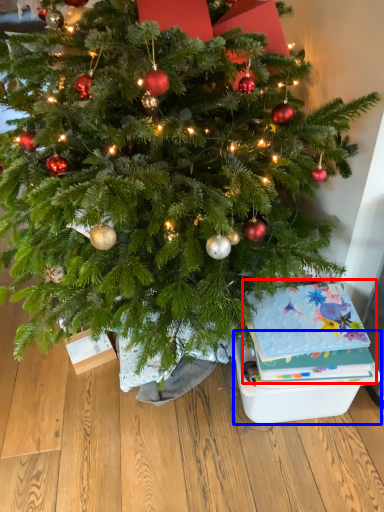
Question: Which object is closer to the camera taking this photo, christmas card (highlighted by a red box) or storage box (highlighted by a blue box)?

Choices:
 (A) christmas card
 (B) storage box

Answer: (A)